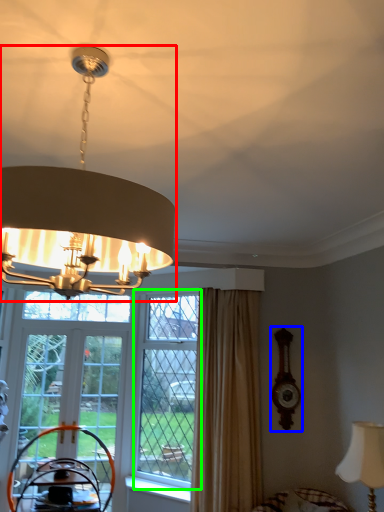
Question: Based on their relative distances, which object is nearer to lamp (highlighted by a red box)? Choose from clock (highlighted by a blue box) and window (highlighted by a green box).

Choices:
 (A) clock
 (B) window

Answer: (B)